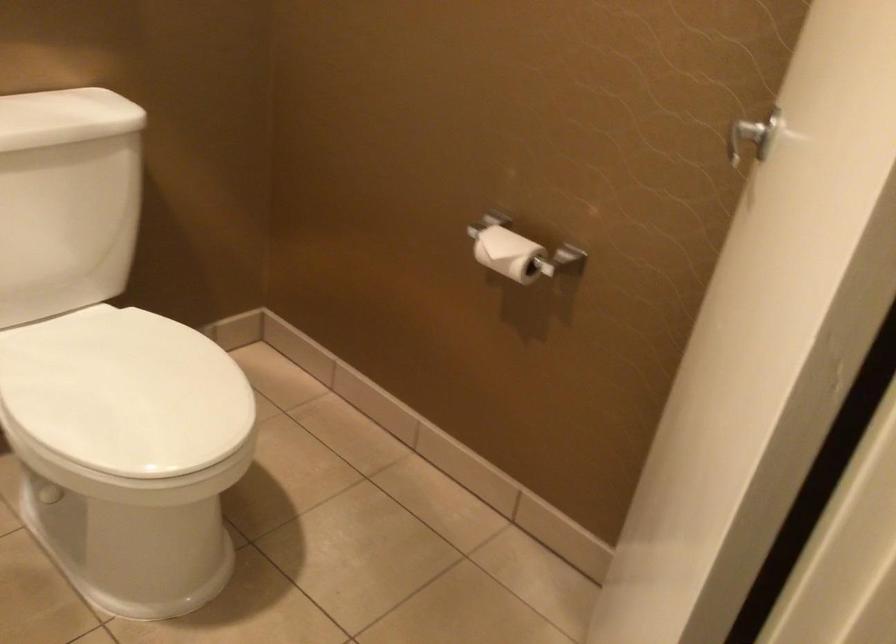
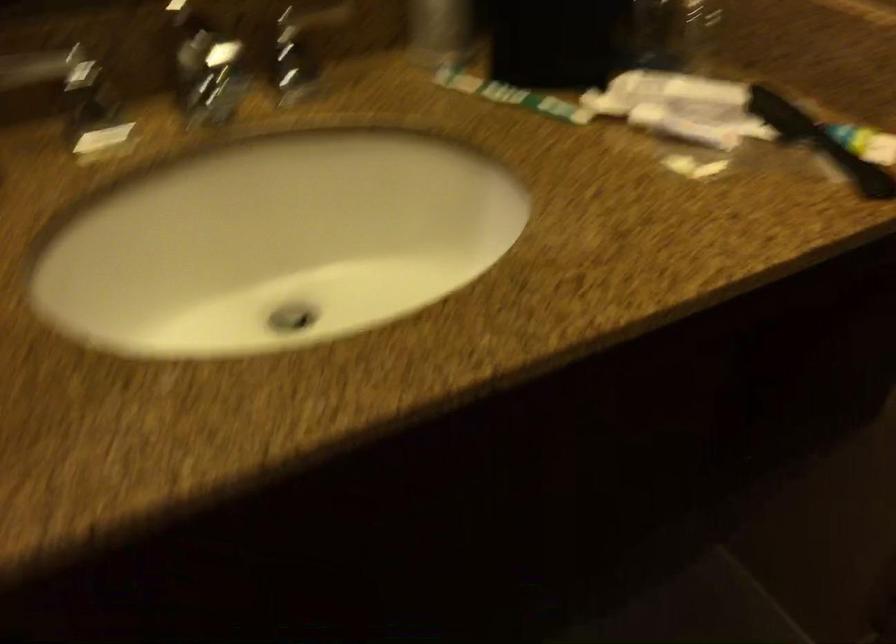
The first image is from the beginning of the video and the second image is from the end. How did the camera likely rotate when shooting the video?

The rotation direction of the camera is right-down.